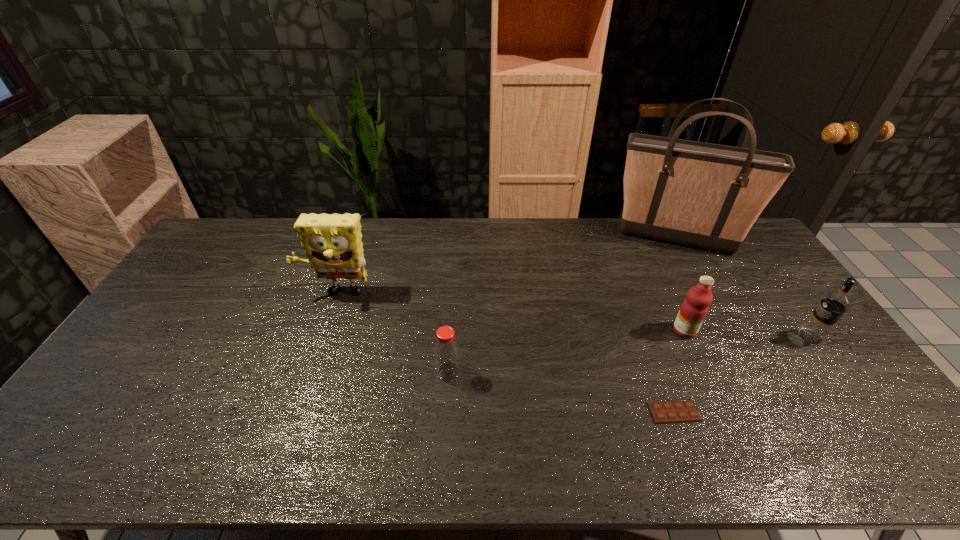
The height and width of the screenshot is (540, 960). I want to click on free space that satisfies the following two spatial constraints: 1. on the face of the fifth nearest object; 2. on the left side of the bottle, so click(310, 372).

This screenshot has width=960, height=540. Identify the location of vacant space that satisfies the following two spatial constraints: 1. on the face of the second farthest object; 2. on the left side of the chocolate bar. (296, 412).

Find the location of `free spot that satisfies the following two spatial constraints: 1. on the face of the second farthest object; 2. on the right side of the bottle`. free spot that satisfies the following two spatial constraints: 1. on the face of the second farthest object; 2. on the right side of the bottle is located at coordinates (310, 372).

Image resolution: width=960 pixels, height=540 pixels. I want to click on vacant region that satisfies the following two spatial constraints: 1. on the face of the shortest object; 2. on the right side of the sponge, so click(x=296, y=412).

At what (x,y) coordinates should I click in order to perform the action: click on vacant space that satisfies the following two spatial constraints: 1. on the label of the vodka; 2. on the front side of the second nearest object. Please return your answer as a coordinate pair (x, y). The image size is (960, 540). Looking at the image, I should click on (836, 372).

Where is `vacant area in the image that satisfies the following two spatial constraints: 1. on the front side of the chocolate bar; 2. on the left side of the fifth tallest object`? This screenshot has width=960, height=540. vacant area in the image that satisfies the following two spatial constraints: 1. on the front side of the chocolate bar; 2. on the left side of the fifth tallest object is located at coordinates (445, 412).